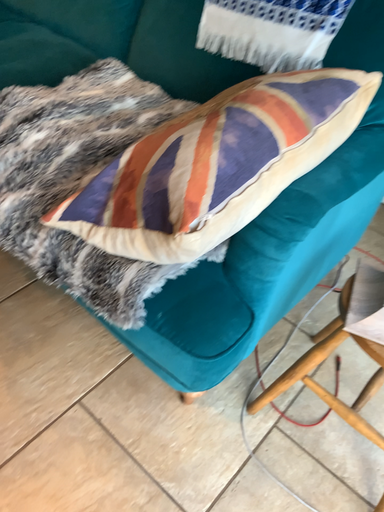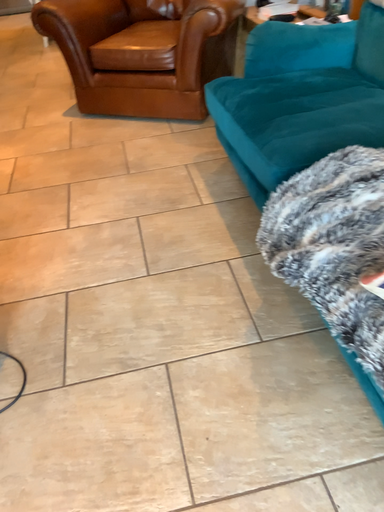
Question: How did the camera likely rotate when shooting the video?

Choices:
 (A) rotated downward
 (B) rotated upward

Answer: (B)